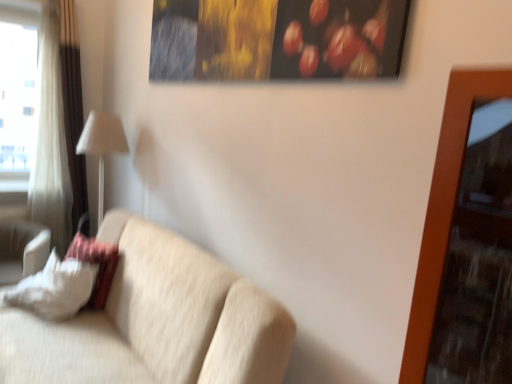
Describe the element at coordinates (102, 145) in the screenshot. The image size is (512, 384). I see `white fabric lampshade at left` at that location.

What is the approximate height of white fabric pillow at left, the 2th pillow in the left-to-right sequence?

white fabric pillow at left, the 2th pillow in the left-to-right sequence, is 19.39 inches tall.

What do you see at coordinates (51, 138) in the screenshot? I see `white fabric curtain at left` at bounding box center [51, 138].

In order to face white fabric curtain at left, should I rotate leftwards or rightwards?

You should look left and rotate roughly 26.922 degrees.

Find the location of a particular element. beige fabric couch at center is located at coordinates (155, 322).

Identify the location of white fabric lampshade at left. (102, 145).

Does beige fabric couch at center have a larger size compared to white soft pillow at lower left, which is the first pillow in left-to-right order?

Correct, beige fabric couch at center is larger in size than white soft pillow at lower left, which is the first pillow in left-to-right order.

Is beige fabric couch at center positioned far away from white soft pillow at lower left, which is the first pillow in left-to-right order?

No, beige fabric couch at center is not far away from white soft pillow at lower left, which is the first pillow in left-to-right order.

Who is more distant, beige fabric couch at center or white soft pillow at lower left, which is the first pillow in left-to-right order?

white soft pillow at lower left, which is the first pillow in left-to-right order.

Which is farther, (279, 324) or (44, 307)?

Point (44, 307)

There is a white soft pillow at lower left, the 2th pillow viewed from the right. Find the location of `curtain above it (from a real-world perspective)`. curtain above it (from a real-world perspective) is located at coordinates (51, 138).

Does white soft pillow at lower left, the 2th pillow viewed from the right, have a smaller size compared to white fabric curtain at left?

Actually, white soft pillow at lower left, the 2th pillow viewed from the right, might be larger than white fabric curtain at left.

From a real-world perspective, which is physically below, white soft pillow at lower left, the 2th pillow viewed from the right, or white fabric curtain at left?

white soft pillow at lower left, the 2th pillow viewed from the right.

Considering the positions of objects white soft pillow at lower left, which is the first pillow in left-to-right order, and white fabric curtain at left in the image provided, who is more to the right, white soft pillow at lower left, which is the first pillow in left-to-right order, or white fabric curtain at left?

white soft pillow at lower left, which is the first pillow in left-to-right order, is more to the right.

Does white fabric pillow at left, the 1th pillow from the right, have a smaller size compared to beige fabric couch at center?

Yes, white fabric pillow at left, the 1th pillow from the right, is smaller than beige fabric couch at center.

Which point is more forward, (100, 245) or (221, 315)?

Positioned in front is point (221, 315).

This screenshot has height=384, width=512. I want to click on studio couch in front of the white fabric pillow at left, the 1th pillow from the right, so 155,322.

Considering the relative positions of white fabric pillow at left, the 1th pillow from the right, and beige fabric couch at center in the image provided, is white fabric pillow at left, the 1th pillow from the right, in front of beige fabric couch at center?

No, white fabric pillow at left, the 1th pillow from the right, is further to the viewer.

Between white fabric curtain at left and white fabric lampshade at left, which one appears on the left side from the viewer's perspective?

Positioned to the left is white fabric curtain at left.

From the image's perspective, which is above, white fabric curtain at left or white fabric lampshade at left?

white fabric curtain at left.

Where is `curtain above the white fabric lampshade at left (from the image's perspective)`? curtain above the white fabric lampshade at left (from the image's perspective) is located at coordinates pyautogui.click(x=51, y=138).

Is white fabric curtain at left thinner than white fabric lampshade at left?

Indeed, white fabric curtain at left has a lesser width compared to white fabric lampshade at left.

In the scene shown: Considering the relative positions of white fabric curtain at left and white fabric pillow at left, the 1th pillow from the right, in the image provided, is white fabric curtain at left behind white fabric pillow at left, the 1th pillow from the right,?

Yes, white fabric curtain at left is behind white fabric pillow at left, the 1th pillow from the right.

Is white fabric curtain at left facing towards white fabric pillow at left, the 2th pillow in the left-to-right sequence?

Yes, white fabric curtain at left is oriented towards white fabric pillow at left, the 2th pillow in the left-to-right sequence.

From a real-world perspective, is white fabric curtain at left above or below white fabric pillow at left, the 2th pillow in the left-to-right sequence?

In terms of real-world spatial position, white fabric curtain at left is above white fabric pillow at left, the 2th pillow in the left-to-right sequence.

From a real-world perspective, is beige fabric couch at center positioned under transparent glass window at left based on gravity?

Correct, in the physical world, beige fabric couch at center is lower than transparent glass window at left.

Is beige fabric couch at center outside of transparent glass window at left?

Yes, beige fabric couch at center is outside of transparent glass window at left.

Is point (273, 348) closer or farther from the camera than point (12, 132)?

Point (273, 348) is positioned closer to the camera compared to point (12, 132).

From a real-world perspective, which is physically above, beige fabric couch at center or white fabric curtain at left?

From a 3D spatial view, white fabric curtain at left is above.

Considering the relative sizes of beige fabric couch at center and white fabric curtain at left in the image provided, is beige fabric couch at center bigger than white fabric curtain at left?

Correct, beige fabric couch at center is larger in size than white fabric curtain at left.

Based on the photo, considering the relative sizes of beige fabric couch at center and white fabric curtain at left in the image provided, is beige fabric couch at center shorter than white fabric curtain at left?

Yes.

The width and height of the screenshot is (512, 384). Identify the location of pillow below the beige fabric couch at center (from a real-world perspective). (55, 288).

In the image, there is a white soft pillow at lower left, the 2th pillow viewed from the right. Identify the location of curtain above it (from the image's perspective). The width and height of the screenshot is (512, 384). (51, 138).

Considering their positions, is beige fabric couch at center positioned further to white fabric lampshade at left than transparent glass window at left?

beige fabric couch at center is positioned further to the anchor white fabric lampshade at left.

Based on their spatial positions, is transparent glass window at left or white fabric lampshade at left closer to beige fabric couch at center?

Based on the image, white fabric lampshade at left appears to be nearer to beige fabric couch at center.

Looking at the image, which one is located further to white fabric lampshade at left, white fabric curtain at left or beige fabric couch at center?

beige fabric couch at center is further to white fabric lampshade at left.

When comparing their distances from white fabric curtain at left, does white soft pillow at lower left, which is the first pillow in left-to-right order, or white fabric pillow at left, the 1th pillow from the right, seem closer?

Among the two, white fabric pillow at left, the 1th pillow from the right, is located nearer to white fabric curtain at left.

When comparing their distances from transparent glass window at left, does beige fabric couch at center or white fabric lampshade at left seem further?

The object further to transparent glass window at left is beige fabric couch at center.

Which object lies further to the anchor point white fabric lampshade at left, transparent glass window at left or white fabric curtain at left?

transparent glass window at left.

Which object lies nearer to the anchor point white fabric curtain at left, beige fabric couch at center or white fabric pillow at left, the 2th pillow in the left-to-right sequence?

white fabric pillow at left, the 2th pillow in the left-to-right sequence, lies closer to white fabric curtain at left than the other object.

From the image, which object appears to be nearer to white soft pillow at lower left, which is the first pillow in left-to-right order, beige fabric couch at center or white fabric curtain at left?

The object closer to white soft pillow at lower left, which is the first pillow in left-to-right order, is beige fabric couch at center.

Find the location of a particular element. Image resolution: width=512 pixels, height=384 pixels. table lamp between white fabric curtain at left and white soft pillow at lower left, which is the first pillow in left-to-right order, in the vertical direction is located at coordinates pyautogui.click(x=102, y=145).

Image resolution: width=512 pixels, height=384 pixels. I want to click on pillow between transparent glass window at left and white soft pillow at lower left, the 2th pillow viewed from the right, vertically, so click(x=96, y=263).

Locate an element on the screen. table lamp between beige fabric couch at center and white fabric curtain at left from front to back is located at coordinates (102, 145).

Identify the location of curtain located between transparent glass window at left and white fabric lampshade at left in the left-right direction. (51, 138).